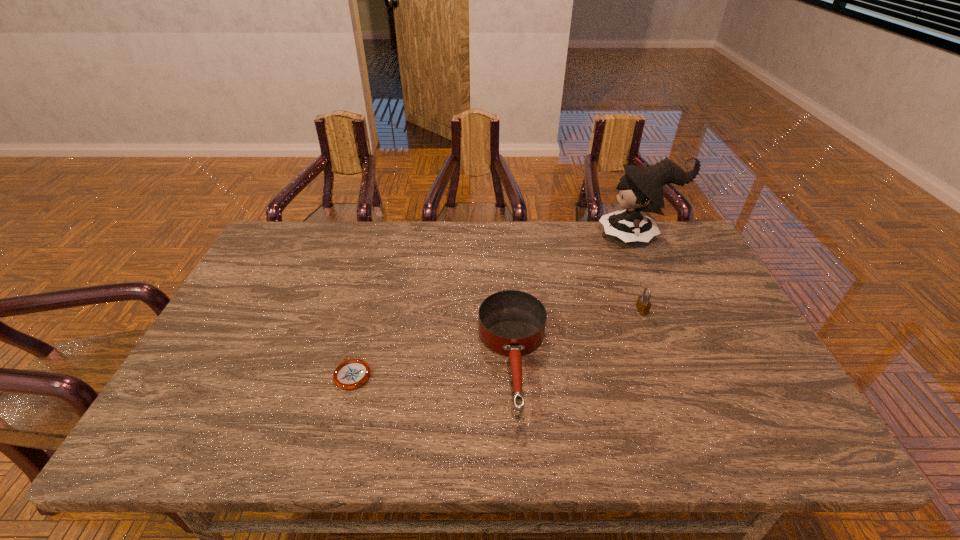
The width and height of the screenshot is (960, 540). Find the location of `the farthest object`. the farthest object is located at coordinates (641, 189).

I want to click on doll, so click(x=641, y=189).

Locate an element on the screen. Image resolution: width=960 pixels, height=540 pixels. padlock is located at coordinates (643, 304).

In order to click on the second object from left to right in this screenshot , I will do `click(512, 323)`.

Identify the location of compass. The height and width of the screenshot is (540, 960). (353, 373).

Locate an element on the screen. The width and height of the screenshot is (960, 540). the leftmost object is located at coordinates (353, 373).

Find the location of a particular element. The image size is (960, 540). free location located 0.270m at the face of the doll is located at coordinates (519, 237).

I want to click on blank area located 0.330m at the face of the doll, so click(x=502, y=237).

At what (x,y) coordinates should I click in order to perform the action: click on blank space located 0.230m at the face of the doll. Please return your answer as a coordinate pair (x, y). The image size is (960, 540). Looking at the image, I should click on (531, 237).

Locate an element on the screen. The height and width of the screenshot is (540, 960). vacant space located on the back of the padlock is located at coordinates (633, 286).